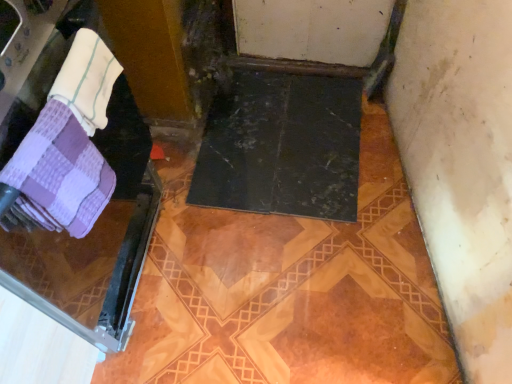
What do you see at coordinates (78, 199) in the screenshot? I see `purple checkered towel at left` at bounding box center [78, 199].

Measure the distance between point (84, 232) and camera.

Point (84, 232) is 27.17 inches away from camera.

Describe the element at coordinates (57, 176) in the screenshot. The image size is (512, 384). I see `purple checkered towel at left, the first towel in the bottom-to-top sequence` at that location.

At what (x,y) coordinates should I click in order to perform the action: click on purple checkered towel at left. Please return your answer as a coordinate pair (x, y). Looking at the image, I should click on (78, 199).

Can you confirm if white terry cloth towel at upper left, the 2th towel in the bottom-to-top sequence, is thinner than purple checkered towel at left?

Correct, the width of white terry cloth towel at upper left, the 2th towel in the bottom-to-top sequence, is less than that of purple checkered towel at left.

Considering the relative sizes of white terry cloth towel at upper left, the 2th towel in the bottom-to-top sequence, and purple checkered towel at left in the image provided, is white terry cloth towel at upper left, the 2th towel in the bottom-to-top sequence, bigger than purple checkered towel at left?

Incorrect, white terry cloth towel at upper left, the 2th towel in the bottom-to-top sequence, is not larger than purple checkered towel at left.

From the picture: From the image's perspective, is white terry cloth towel at upper left, which is the first towel in top-to-bottom order, beneath purple checkered towel at left?

No.

In terms of width, does purple checkered towel at left, the first towel in the bottom-to-top sequence, look wider or thinner when compared to purple checkered towel at left?

Clearly, purple checkered towel at left, the first towel in the bottom-to-top sequence, has less width compared to purple checkered towel at left.

Is purple checkered towel at left a part of purple checkered towel at left, the first towel in the bottom-to-top sequence?

That's incorrect, purple checkered towel at left is not inside purple checkered towel at left, the first towel in the bottom-to-top sequence.

Which object is positioned more to the right, purple checkered towel at left, the first towel in the bottom-to-top sequence, or purple checkered towel at left?

From the viewer's perspective, purple checkered towel at left, the first towel in the bottom-to-top sequence, appears more on the right side.

How many degrees apart are the facing directions of purple checkered towel at left, placed as the 2th towel when sorted from top to bottom, and purple checkered towel at left?

9.35 degrees separate the facing orientations of purple checkered towel at left, placed as the 2th towel when sorted from top to bottom, and purple checkered towel at left.

How many degrees apart are the facing directions of white terry cloth towel at upper left, the 2th towel in the bottom-to-top sequence, and purple checkered towel at left, placed as the 2th towel when sorted from top to bottom?

The angular difference between white terry cloth towel at upper left, the 2th towel in the bottom-to-top sequence, and purple checkered towel at left, placed as the 2th towel when sorted from top to bottom, is 12.2 degrees.

Is white terry cloth towel at upper left, which is the first towel in top-to-bottom order, not inside purple checkered towel at left, the first towel in the bottom-to-top sequence?

white terry cloth towel at upper left, which is the first towel in top-to-bottom order, lies outside purple checkered towel at left, the first towel in the bottom-to-top sequence,'s area.

In the scene shown: From the image's perspective, which is below, white terry cloth towel at upper left, which is the first towel in top-to-bottom order, or purple checkered towel at left, placed as the 2th towel when sorted from top to bottom?

purple checkered towel at left, placed as the 2th towel when sorted from top to bottom.

From a real-world perspective, who is located higher, white terry cloth towel at upper left, the 2th towel in the bottom-to-top sequence, or purple checkered towel at left, the first towel in the bottom-to-top sequence?

white terry cloth towel at upper left, the 2th towel in the bottom-to-top sequence, from a real-world perspective.

This screenshot has height=384, width=512. I want to click on screen door that is in front of the white terry cloth towel at upper left, the 2th towel in the bottom-to-top sequence, so click(78, 199).

Who is taller, purple checkered towel at left or white terry cloth towel at upper left, which is the first towel in top-to-bottom order?

purple checkered towel at left.

From the image's perspective, is purple checkered towel at left above or below white terry cloth towel at upper left, the 2th towel in the bottom-to-top sequence?

purple checkered towel at left is below white terry cloth towel at upper left, the 2th towel in the bottom-to-top sequence.

Would you say purple checkered towel at left is a long distance from white terry cloth towel at upper left, the 2th towel in the bottom-to-top sequence?

purple checkered towel at left is actually quite close to white terry cloth towel at upper left, the 2th towel in the bottom-to-top sequence.

From the picture: Can you confirm if purple checkered towel at left is positioned to the right of purple checkered towel at left, placed as the 2th towel when sorted from top to bottom?

No.

Consider the image. Who is shorter, purple checkered towel at left or purple checkered towel at left, the first towel in the bottom-to-top sequence?

With less height is purple checkered towel at left, the first towel in the bottom-to-top sequence.

Can we say purple checkered towel at left lies outside purple checkered towel at left, the first towel in the bottom-to-top sequence?

Absolutely, purple checkered towel at left is external to purple checkered towel at left, the first towel in the bottom-to-top sequence.

Is purple checkered towel at left in front of or behind purple checkered towel at left, the first towel in the bottom-to-top sequence, in the image?

purple checkered towel at left is in front of purple checkered towel at left, the first towel in the bottom-to-top sequence.

From their relative heights in the image, would you say purple checkered towel at left, placed as the 2th towel when sorted from top to bottom, is taller or shorter than white terry cloth towel at upper left, the 2th towel in the bottom-to-top sequence?

Clearly, purple checkered towel at left, placed as the 2th towel when sorted from top to bottom, is taller compared to white terry cloth towel at upper left, the 2th towel in the bottom-to-top sequence.

In the scene shown: Which is more to the left, purple checkered towel at left, placed as the 2th towel when sorted from top to bottom, or white terry cloth towel at upper left, the 2th towel in the bottom-to-top sequence?

Positioned to the left is purple checkered towel at left, placed as the 2th towel when sorted from top to bottom.

From a real-world perspective, which is physically below, purple checkered towel at left, placed as the 2th towel when sorted from top to bottom, or white terry cloth towel at upper left, which is the first towel in top-to-bottom order?

purple checkered towel at left, placed as the 2th towel when sorted from top to bottom.

Is purple checkered towel at left, placed as the 2th towel when sorted from top to bottom, positioned beyond the bounds of white terry cloth towel at upper left, the 2th towel in the bottom-to-top sequence?

Yes, purple checkered towel at left, placed as the 2th towel when sorted from top to bottom, is outside of white terry cloth towel at upper left, the 2th towel in the bottom-to-top sequence.

Where is `towel that is the 2nd one when counting backward from the purple checkered towel at left`? The width and height of the screenshot is (512, 384). towel that is the 2nd one when counting backward from the purple checkered towel at left is located at coordinates (87, 80).

The height and width of the screenshot is (384, 512). What are the coordinates of `screen door located below the purple checkered towel at left, the first towel in the bottom-to-top sequence (from the image's perspective)` in the screenshot? It's located at (78, 199).

Based on their spatial positions, is white terry cloth towel at upper left, which is the first towel in top-to-bottom order, or purple checkered towel at left further from purple checkered towel at left, placed as the 2th towel when sorted from top to bottom?

purple checkered towel at left is positioned further to the anchor purple checkered towel at left, placed as the 2th towel when sorted from top to bottom.

Based on their spatial positions, is purple checkered towel at left, the first towel in the bottom-to-top sequence, or white terry cloth towel at upper left, which is the first towel in top-to-bottom order, further from purple checkered towel at left?

white terry cloth towel at upper left, which is the first towel in top-to-bottom order, is positioned further to the anchor purple checkered towel at left.

Based on their spatial positions, is purple checkered towel at left, placed as the 2th towel when sorted from top to bottom, or purple checkered towel at left closer to white terry cloth towel at upper left, the 2th towel in the bottom-to-top sequence?

purple checkered towel at left, placed as the 2th towel when sorted from top to bottom, is positioned closer to the anchor white terry cloth towel at upper left, the 2th towel in the bottom-to-top sequence.

Estimate the real-world distances between objects in this image. Which object is closer to purple checkered towel at left, placed as the 2th towel when sorted from top to bottom, purple checkered towel at left or white terry cloth towel at upper left, which is the first towel in top-to-bottom order?

white terry cloth towel at upper left, which is the first towel in top-to-bottom order.

In the scene shown: From the image, which object appears to be farther from purple checkered towel at left, white terry cloth towel at upper left, the 2th towel in the bottom-to-top sequence, or purple checkered towel at left, placed as the 2th towel when sorted from top to bottom?

white terry cloth towel at upper left, the 2th towel in the bottom-to-top sequence, is positioned further to the anchor purple checkered towel at left.

When comparing their distances from white terry cloth towel at upper left, which is the first towel in top-to-bottom order, does purple checkered towel at left or purple checkered towel at left, placed as the 2th towel when sorted from top to bottom, seem closer?

Among the two, purple checkered towel at left, placed as the 2th towel when sorted from top to bottom, is located nearer to white terry cloth towel at upper left, which is the first towel in top-to-bottom order.

The height and width of the screenshot is (384, 512). What are the coordinates of `towel situated between purple checkered towel at left and white terry cloth towel at upper left, which is the first towel in top-to-bottom order, from left to right` in the screenshot? It's located at [x=57, y=176].